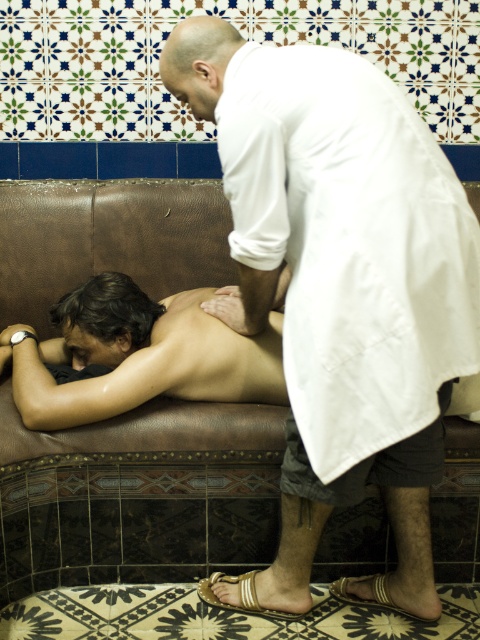
Is white matte robe at center wider than brown leather couch at center?

No.

Is white matte robe at center shorter than brown leather couch at center?

Incorrect, white matte robe at center's height does not fall short of brown leather couch at center's.

Who is more forward, (303, 72) or (41, 182)?

Point (303, 72)

The width and height of the screenshot is (480, 640). What are the coordinates of `white matte robe at center` in the screenshot? It's located at (349, 244).